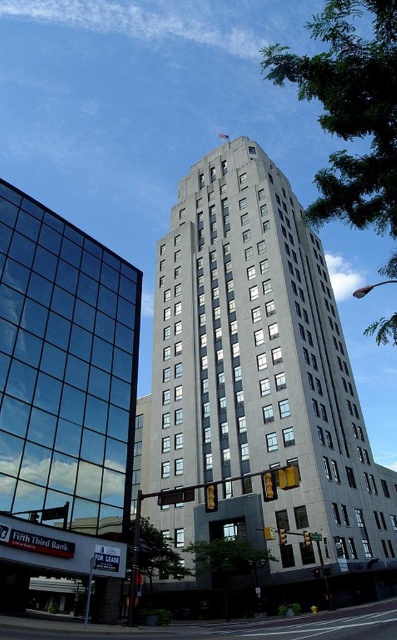
You are standing at the point with coordinates point (x=100, y=312) and want to walk to the point with coordinates point (x=281, y=312). Is there a clear path between these two points without any obstacles?

Point (x=281, y=312) is behind point (x=100, y=312), so there might be an obstacle blocking the path between them.

You are standing at the camera position and want to take a photo of the gray concrete skyscraper at center. If your camera has a maximum focus range of 150 feet, will it be able to capture the skyscraper clearly?

The gray concrete skyscraper at center is 143.32 feet from camera, so yes, the camera can focus on it since the distance is within the 150 feet maximum range.

You are an architect planning to install a new solar panel array. You need to choose between the gray concrete skyscraper at center and the transparent glass building at left. Which building is closer to you, and thus a better candidate for easier installation access?

The gray concrete skyscraper at center is closer to you, making it a better candidate for easier installation access since it is closer than the transparent glass building at left.